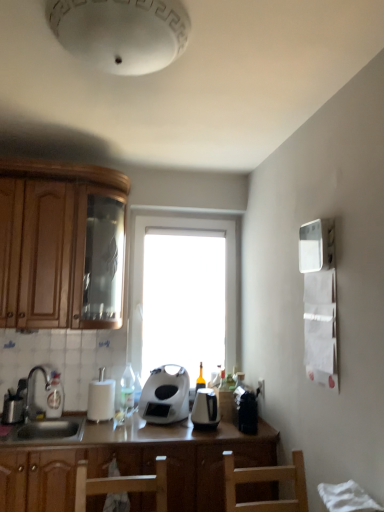
At what (x,y) coordinates should I click in order to perform the action: click on brown wood countertop at center. Please return your answer as a coordinate pair (x, y). Looking at the image, I should click on (132, 463).

What do you see at coordinates (54, 396) in the screenshot? The image size is (384, 512). I see `translucent glass bottle at sink left, arranged as the 1th bottle when viewed from the left` at bounding box center [54, 396].

This screenshot has height=512, width=384. Find the location of `wooden cabinet at left`. wooden cabinet at left is located at coordinates (61, 245).

What do you see at coordinates (143, 285) in the screenshot? I see `transparent glass window at center` at bounding box center [143, 285].

In order to click on transparent glass window at center in this screenshot , I will do `click(143, 285)`.

Find the location of `black plastic coffee machine at lower right`. black plastic coffee machine at lower right is located at coordinates (246, 409).

This screenshot has height=512, width=384. What do you see at coordinates (246, 409) in the screenshot?
I see `black plastic coffee machine at lower right` at bounding box center [246, 409].

This screenshot has width=384, height=512. I want to click on white glossy bottle at center, which is the second bottle from left to right, so click(127, 388).

From the image's perspective, is brown wood countertop at center above or below white matte toaster at center, arranged as the 1th kitchen appliance when viewed from the left?

From the image's perspective, brown wood countertop at center appears below white matte toaster at center, arranged as the 1th kitchen appliance when viewed from the left.

From a real-world perspective, is brown wood countertop at center below white matte toaster at center, arranged as the 1th kitchen appliance when viewed from the left?

Yes, from a real-world perspective, brown wood countertop at center is under white matte toaster at center, arranged as the 1th kitchen appliance when viewed from the left.

Looking at the image, does brown wood countertop at center seem bigger or smaller compared to white matte toaster at center, arranged as the 1th kitchen appliance when viewed from the left?

Considering their sizes, brown wood countertop at center takes up more space than white matte toaster at center, arranged as the 1th kitchen appliance when viewed from the left.

Find the location of `the 2nd kitchen appliance located above the brown wood countertop at center (from a real-world perspective)`. the 2nd kitchen appliance located above the brown wood countertop at center (from a real-world perspective) is located at coordinates (165, 395).

Does brushed metal faucet at lower left contain transparent glass window at center?

No.

Between brushed metal faucet at lower left and transparent glass window at center, which one appears on the left side from the viewer's perspective?

Positioned to the left is brushed metal faucet at lower left.

Is brushed metal faucet at lower left next to transparent glass window at center and touching it?

No.

Is black plastic coffee machine at lower right in front of or behind translucent glass bottle at sink left, arranged as the 1th bottle when viewed from the left, in the image?

In the image, black plastic coffee machine at lower right appears in front of translucent glass bottle at sink left, arranged as the 1th bottle when viewed from the left.

Is translucent glass bottle at sink left, marked as the 2th bottle in a right-to-left arrangement, at the back of black plastic coffee machine at lower right?

No, black plastic coffee machine at lower right's orientation is not away from translucent glass bottle at sink left, marked as the 2th bottle in a right-to-left arrangement.

Which object is positioned more to the left, black plastic coffee machine at lower right or translucent glass bottle at sink left, arranged as the 1th bottle when viewed from the left?

From the viewer's perspective, translucent glass bottle at sink left, arranged as the 1th bottle when viewed from the left, appears more on the left side.

Considering the sizes of objects black plastic coffee machine at lower right and translucent glass bottle at sink left, arranged as the 1th bottle when viewed from the left, in the image provided, who is taller, black plastic coffee machine at lower right or translucent glass bottle at sink left, arranged as the 1th bottle when viewed from the left,?

Standing taller between the two is translucent glass bottle at sink left, arranged as the 1th bottle when viewed from the left.

Is black plastic coffee machine at lower right positioned far away from transparent glass window at center?

No.

From the image's perspective, which one is positioned lower, black plastic coffee machine at lower right or transparent glass window at center?

black plastic coffee machine at lower right is shown below in the image.

Consider the image. Considering the relative sizes of black plastic coffee machine at lower right and transparent glass window at center in the image provided, is black plastic coffee machine at lower right taller than transparent glass window at center?

Incorrect, the height of black plastic coffee machine at lower right is not larger of that of transparent glass window at center.

Is white matte toaster at center, which is the second kitchen appliance from right to left, touching white glossy bottle at center, which is the second bottle from left to right?

No, white matte toaster at center, which is the second kitchen appliance from right to left, is not next to white glossy bottle at center, which is the second bottle from left to right.

Does white matte toaster at center, arranged as the 1th kitchen appliance when viewed from the left, appear on the left side of white glossy bottle at center, which is the 1th bottle from right to left?

In fact, white matte toaster at center, arranged as the 1th kitchen appliance when viewed from the left, is to the right of white glossy bottle at center, which is the 1th bottle from right to left.

The width and height of the screenshot is (384, 512). What are the coordinates of `the 1st kitchen appliance in front of the white glossy bottle at center, which is the 1th bottle from right to left, starting your count from the anchor` in the screenshot? It's located at (165, 395).

Is white matte toaster at center, which is the second kitchen appliance from right to left, facing towards white glossy bottle at center, which is the 1th bottle from right to left?

No, white matte toaster at center, which is the second kitchen appliance from right to left, does not turn towards white glossy bottle at center, which is the 1th bottle from right to left.

Which of these two, white matte paper towel holder at center or black plastic coffee machine at lower right, stands taller?

Standing taller between the two is white matte paper towel holder at center.

What are the coordinates of `coffee machine on the right of the white matte paper towel holder at center` in the screenshot? It's located at (246, 409).

Is white matte paper towel holder at center oriented towards black plastic coffee machine at lower right?

No, white matte paper towel holder at center is not turned towards black plastic coffee machine at lower right.

Is white glossy bottle at center, which is the 1th bottle from right to left, thinner than brown wood countertop at center?

Yes.

Identify the location of countertop located on the right of white glossy bottle at center, which is the second bottle from left to right. (132, 463).

Is white glossy bottle at center, which is the 1th bottle from right to left, positioned with its back to brown wood countertop at center?

No, brown wood countertop at center is not at the back of white glossy bottle at center, which is the 1th bottle from right to left.

Can you tell me how much white glossy bottle at center, which is the 1th bottle from right to left, and brown wood countertop at center differ in facing direction?

0.237 degrees separate the facing orientations of white glossy bottle at center, which is the 1th bottle from right to left, and brown wood countertop at center.

From the image's perspective, which kitchen appliance is the 2nd one above the brown wood countertop at center? Please provide its 2D coordinates.

[(165, 395)]

This screenshot has width=384, height=512. Find the location of `window behind the brushed metal faucet at lower left`. window behind the brushed metal faucet at lower left is located at coordinates (143, 285).

Estimate the real-world distances between objects in this image. Which object is further from wooden cabinet at left, black plastic kettle at center, marked as the 2th kitchen appliance in a left-to-right arrangement, or white matte paper towel holder at center?

Among the two, black plastic kettle at center, marked as the 2th kitchen appliance in a left-to-right arrangement, is located further to wooden cabinet at left.

Considering their positions, is brown wood countertop at center positioned closer to white matte toaster at center, arranged as the 1th kitchen appliance when viewed from the left, than black plastic kettle at center, which appears as the 1th kitchen appliance when viewed from the right?

black plastic kettle at center, which appears as the 1th kitchen appliance when viewed from the right, lies closer to white matte toaster at center, arranged as the 1th kitchen appliance when viewed from the left, than the other object.

Considering their positions, is translucent glass bottle at sink left, marked as the 2th bottle in a right-to-left arrangement, positioned closer to transparent glass window at center than white matte paper towel holder at center?

Based on the image, white matte paper towel holder at center appears to be nearer to transparent glass window at center.

Considering their positions, is transparent glass window at center positioned closer to translucent glass bottle at sink left, arranged as the 1th bottle when viewed from the left, than brushed metal faucet at lower left?

brushed metal faucet at lower left lies closer to translucent glass bottle at sink left, arranged as the 1th bottle when viewed from the left, than the other object.

Based on their spatial positions, is brushed metal faucet at lower left or brown wood countertop at center further from wooden cabinet at left?

brown wood countertop at center lies further to wooden cabinet at left than the other object.

Based on their spatial positions, is white glossy bottle at center, which is the 1th bottle from right to left, or translucent glass bottle at sink left, arranged as the 1th bottle when viewed from the left, closer to white matte paper towel holder at center?

white glossy bottle at center, which is the 1th bottle from right to left.

From the image, which object appears to be nearer to white matte paper towel holder at center, brushed metal faucet at lower left or black plastic coffee machine at lower right?

brushed metal faucet at lower left is positioned closer to the anchor white matte paper towel holder at center.

From the image, which object appears to be nearer to translucent glass bottle at sink left, marked as the 2th bottle in a right-to-left arrangement, black plastic coffee machine at lower right or brown wood countertop at center?

brown wood countertop at center is closer to translucent glass bottle at sink left, marked as the 2th bottle in a right-to-left arrangement.

Identify the location of appliance between brushed metal faucet at lower left and brown wood countertop at center from left to right. (101, 398).

You are a GUI agent. You are given a task and a screenshot of the screen. Output one action in this format:
    pyautogui.click(x=<x>, y=<y>)
    Task: Click on the bottle between translucent glass bottle at sink left, arranged as the 1th bottle when viewed from the left, and white matte toaster at center, which is the second kitchen appliance from right to left, in the horizontal direction
    
    Given the screenshot: What is the action you would take?
    pyautogui.click(x=127, y=388)

Image resolution: width=384 pixels, height=512 pixels. Identify the location of window located between wooden cabinet at left and black plastic coffee machine at lower right in the left-right direction. (143, 285).

This screenshot has width=384, height=512. In order to click on appliance that lies between wooden cabinet at left and brown wood countertop at center from top to bottom in this screenshot , I will do `click(101, 398)`.